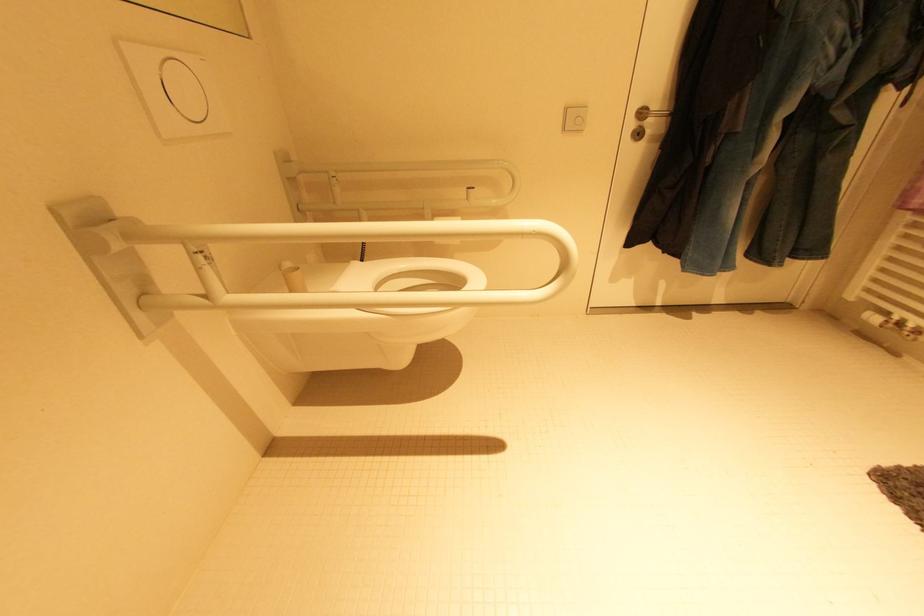
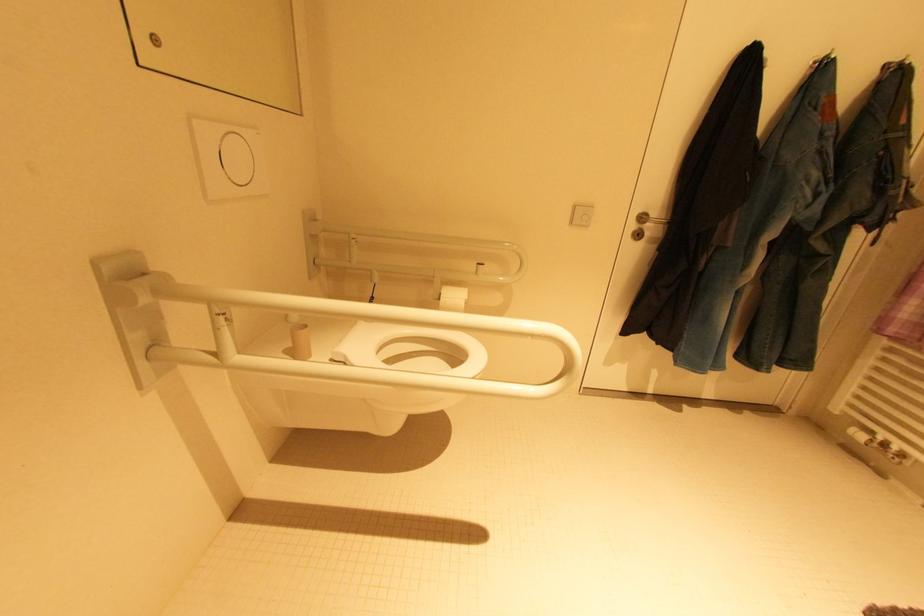
Question: The first image is from the beginning of the video and the second image is from the end. How did the camera likely rotate when shooting the video?

Choices:
 (A) Left
 (B) Right
 (C) Up
 (D) Down

Answer: (C)